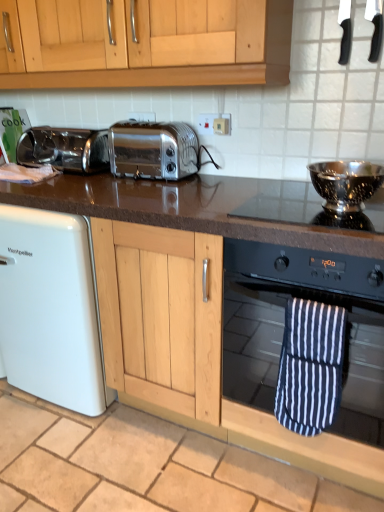
Question: Is point (321, 419) closer or farther from the camera than point (372, 50)?

Choices:
 (A) closer
 (B) farther

Answer: (A)

Question: From a real-world perspective, relative to black plastic knife at upper right, positioned as the second appliance in top-to-bottom order, is blue and white striped oven mitt at lower right vertically above or below?

Choices:
 (A) below
 (B) above

Answer: (A)

Question: Based on their relative distances, which object is farther from the black granite countertop at center?

Choices:
 (A) satin chrome toaster at center, marked as the second toaster in a right-to-left arrangement
 (B) black plastic knife at upper right, placed as the third appliance when sorted from bottom to top
 (C) polished stainless steel bowl at upper right
 (D) black glass oven at center
 (E) black plastic knife at upper right, positioned as the second appliance in top-to-bottom order

Answer: (E)

Question: Which object is the closest to the beige tile at lower center?

Choices:
 (A) satin chrome toaster at center, marked as the second toaster in a right-to-left arrangement
 (B) white plastic electric outlet at upper center
 (C) polished stainless steel bowl at upper right
 (D) black plastic knife at upper right, placed as the third appliance when sorted from bottom to top
 (E) blue and white striped oven mitt at lower right

Answer: (E)